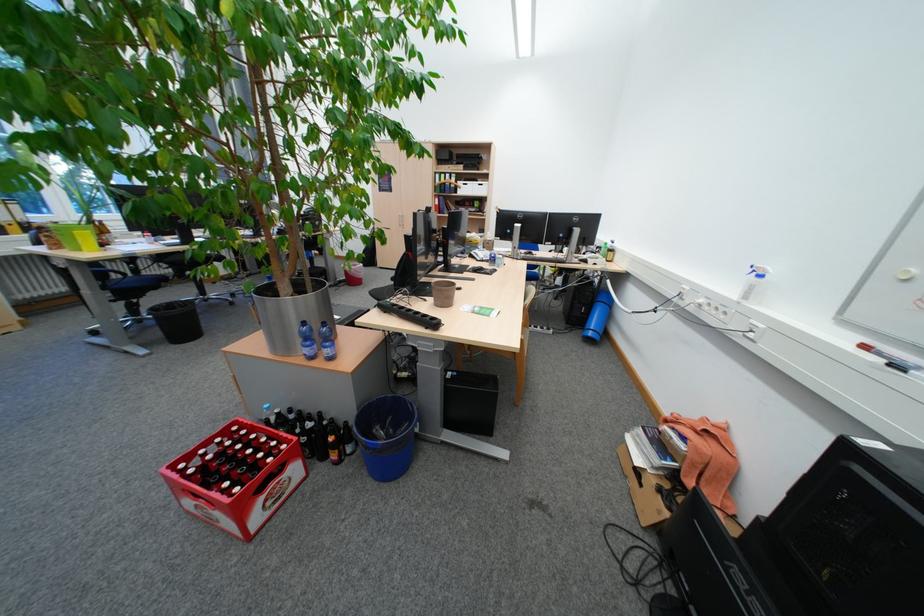
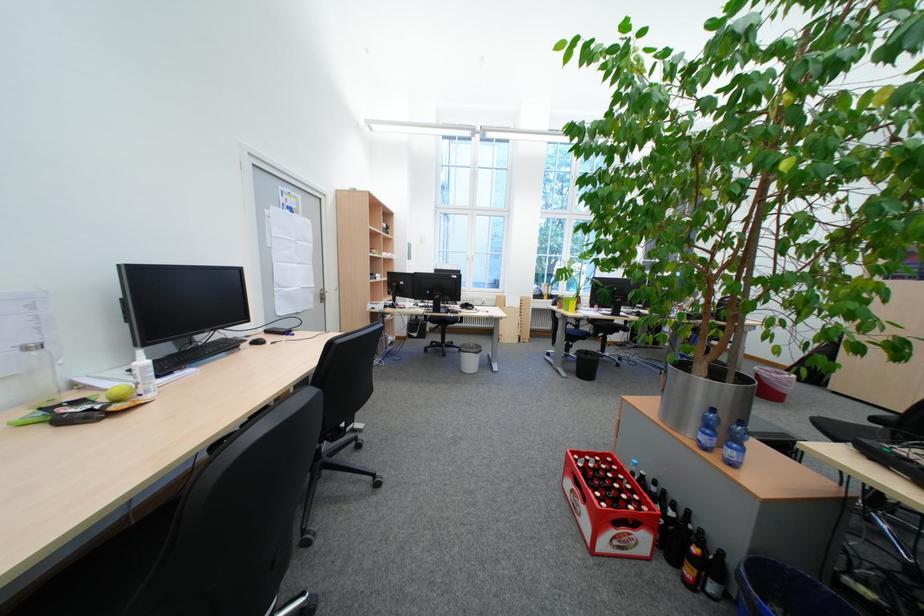
Find the pixel in the second image that matches point (314, 429) in the first image.

(676, 511)